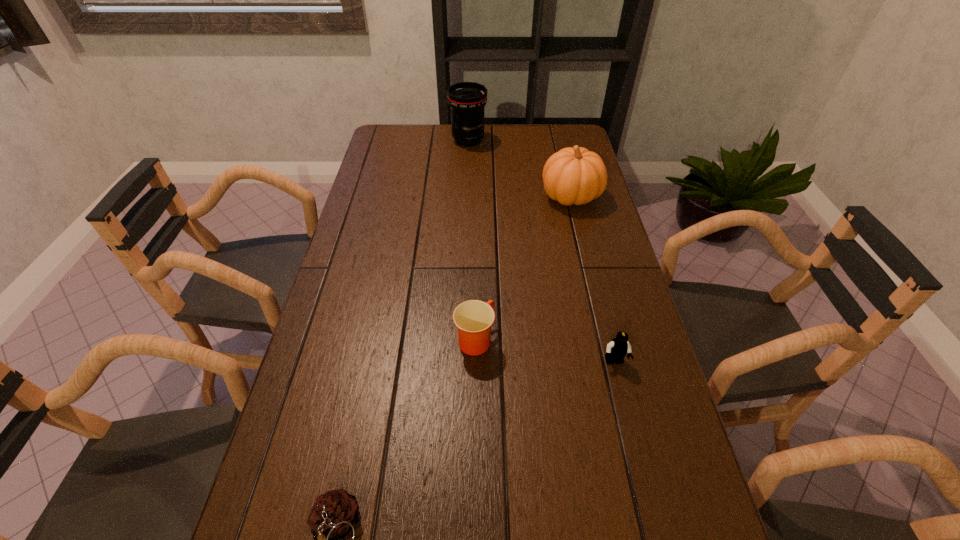
Where is `the farthest object`? the farthest object is located at coordinates (x=467, y=100).

I want to click on pumpkin, so click(x=576, y=175).

This screenshot has height=540, width=960. Identify the location of cup. (473, 318).

Locate an element on the screen. Lego is located at coordinates (616, 350).

Identify the location of vacant space located 0.360m on the right of the farthest object. The image size is (960, 540). (578, 140).

Find the location of `free space located on the left of the pumpkin`. free space located on the left of the pumpkin is located at coordinates (506, 196).

The height and width of the screenshot is (540, 960). Find the location of `vacant space situated 0.190m on the right of the cup`. vacant space situated 0.190m on the right of the cup is located at coordinates (572, 339).

Locate an element on the screen. The height and width of the screenshot is (540, 960). free space located 0.210m on the front-facing side of the Lego is located at coordinates (638, 461).

Locate an element on the screen. object that is at the far edge is located at coordinates (467, 100).

At what (x,y) coordinates should I click in order to perform the action: click on pumpkin at the right edge. Please return your answer as a coordinate pair (x, y). Image resolution: width=960 pixels, height=540 pixels. Looking at the image, I should click on (576, 175).